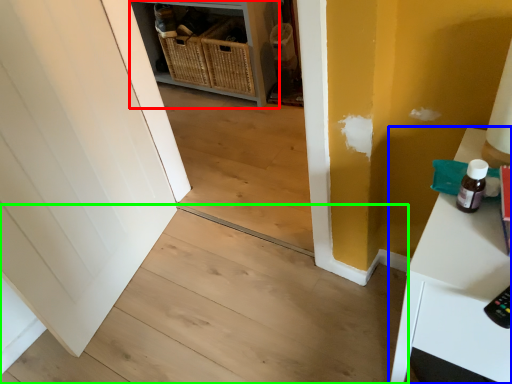
Question: Estimate the real-world distances between objects in this image. Which object is farther from shelf (highlighted by a red box), table (highlighted by a blue box) or stair (highlighted by a green box)?

Choices:
 (A) table
 (B) stair

Answer: (A)